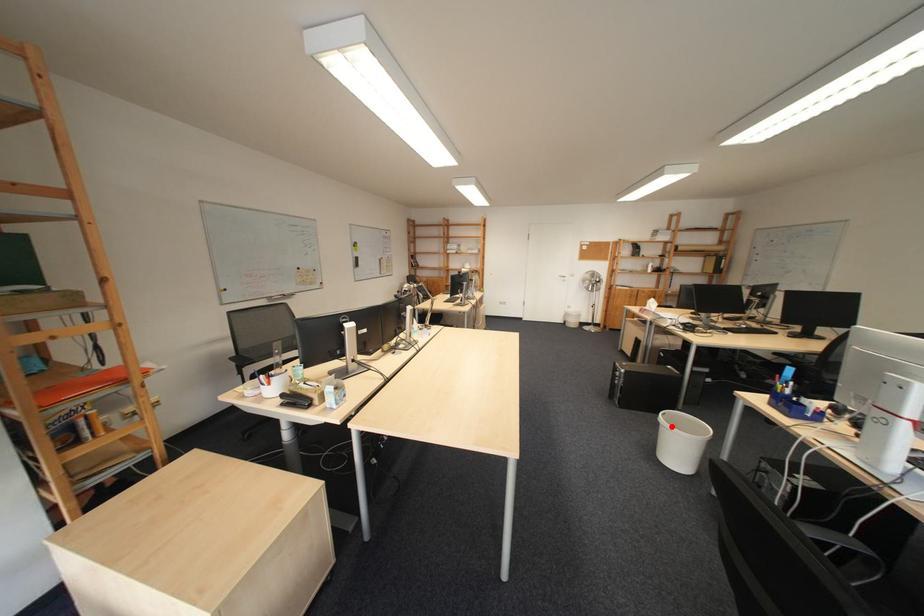
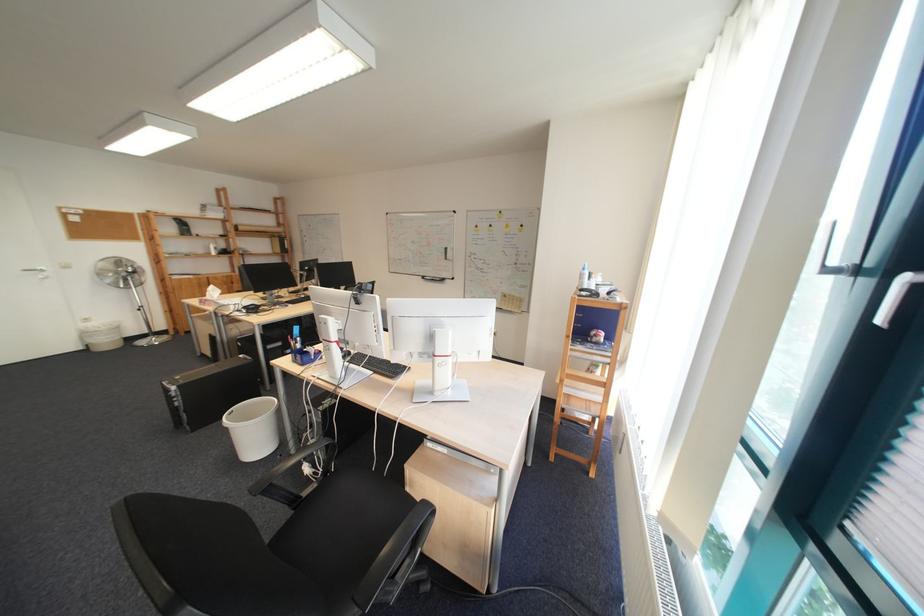
In the second image, find the point that corresponds to the highlighted location in the first image.

(239, 430)